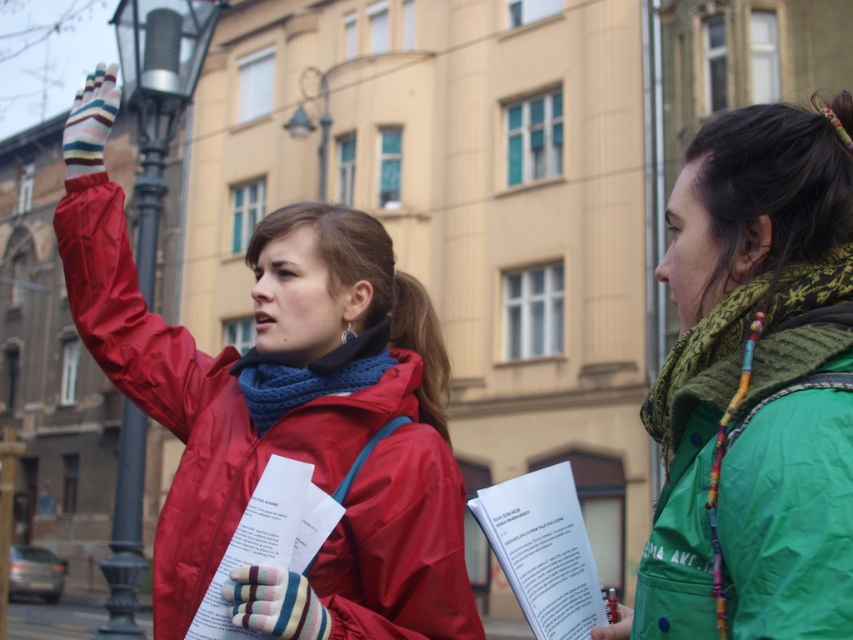
Question: Can you confirm if matte red jacket at left is positioned below green knitted scarf at right?

Choices:
 (A) no
 (B) yes

Answer: (A)

Question: Which point appears farthest from the camera in this image?

Choices:
 (A) (788, 275)
 (B) (700, 353)
 (C) (126, 440)

Answer: (C)

Question: Does metallic silver lamp post at left appear on the left side of blue knitted scarf at center?

Choices:
 (A) no
 (B) yes

Answer: (B)

Question: Which point is closer to the camera?

Choices:
 (A) matte red jacket at left
 (B) green knitted scarf at right
 (C) green matte jacket at right

Answer: (C)

Question: Observing the image, what is the correct spatial positioning of metallic silver lamp post at left in reference to green knitted scarf at right?

Choices:
 (A) above
 (B) below

Answer: (A)

Question: Which of the following is the farthest from the observer?

Choices:
 (A) (749, 317)
 (B) (802, 310)
 (C) (289, 300)

Answer: (C)